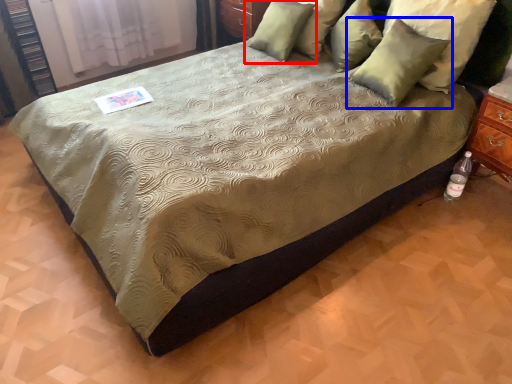
Question: Which object appears closest to the camera in this image, pillow (highlighted by a red box) or pillow (highlighted by a blue box)?

Choices:
 (A) pillow
 (B) pillow

Answer: (B)